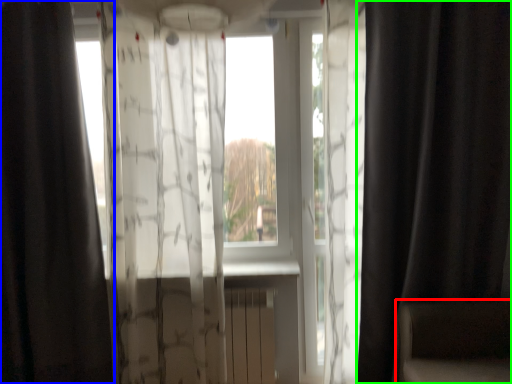
Question: Which object is the closest to the armchair (highlighted by a red box)? Choose among these: curtain (highlighted by a blue box) or curtain (highlighted by a green box).

Choices:
 (A) curtain
 (B) curtain

Answer: (B)